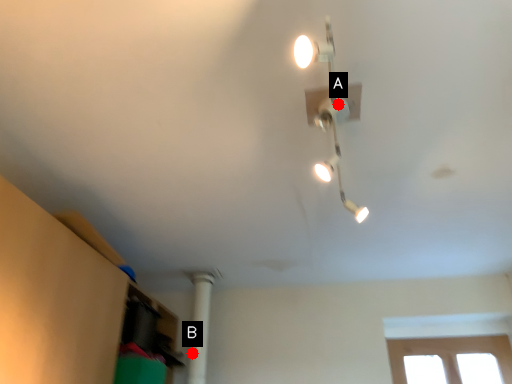
Question: Two points are circled on the image, labeled by A and B beside each circle. Which of the following is the closest to the observer?

Choices:
 (A) A is closer
 (B) B is closer

Answer: (A)